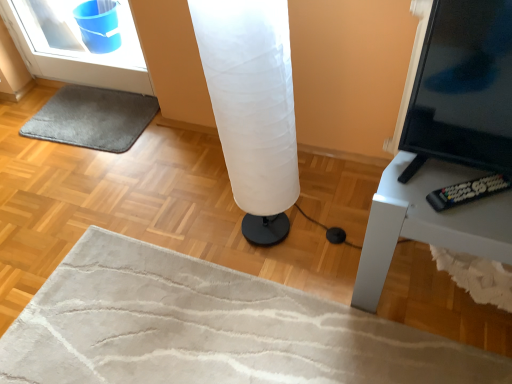
Describe the element at coordinates (463, 88) in the screenshot. I see `black glossy screen at right` at that location.

This screenshot has height=384, width=512. Describe the element at coordinates (252, 106) in the screenshot. I see `white fabric lamp at center` at that location.

Where is `gray soft rug at lower left`? This screenshot has width=512, height=384. gray soft rug at lower left is located at coordinates (92, 118).

At what (x,y) coordinates should I click in order to perform the action: click on black glossy screen at right. Please return your answer as a coordinate pair (x, y). The height and width of the screenshot is (384, 512). Looking at the image, I should click on (463, 88).

Is white fabric lamp at center oriented away from black glossy screen at right?

That's not correct — white fabric lamp at center is not looking away from black glossy screen at right.

Considering the relative positions of white fabric lamp at center and black glossy screen at right in the image provided, is white fabric lamp at center to the left or to the right of black glossy screen at right?

Clearly, white fabric lamp at center is on the left of black glossy screen at right in the image.

From the image's perspective, which one is positioned higher, white fabric lamp at center or black glossy screen at right?

black glossy screen at right, from the image's perspective.

Measure the distance between black plastic tv stand at right and gray soft rug at lower left.

black plastic tv stand at right and gray soft rug at lower left are 4.57 feet apart.

From a real-world perspective, is black plastic tv stand at right under gray soft rug at lower left?

No, from a real-world perspective, black plastic tv stand at right is not below gray soft rug at lower left.

Is black plastic tv stand at right behind gray soft rug at lower left?

No, it is not.

Does point (493, 255) appear closer or farther from the camera than point (104, 138)?

Clearly, point (493, 255) is closer to the camera than point (104, 138).

Looking at their sizes, would you say gray soft rug at lower left is wider or thinner than black glossy screen at right?

gray soft rug at lower left is wider than black glossy screen at right.

In the scene shown: Are gray soft rug at lower left and black glossy screen at right beside each other?

gray soft rug at lower left and black glossy screen at right are not in contact.

Based on the photo, is gray soft rug at lower left inside or outside of black glossy screen at right?

gray soft rug at lower left is not enclosed by black glossy screen at right.

Who is shorter, gray soft rug at lower left or black glossy screen at right?

Standing shorter between the two is gray soft rug at lower left.

From the picture: Which is behind, black glossy screen at right or white fabric lamp at center?

Positioned behind is white fabric lamp at center.

Would you say black glossy screen at right is a long distance from white fabric lamp at center?

No, black glossy screen at right is not far from white fabric lamp at center.

From a real-world perspective, which is physically below, black glossy screen at right or white fabric lamp at center?

From a 3D spatial view, white fabric lamp at center is below.

Which of these two, black glossy screen at right or white fabric lamp at center, stands taller?

white fabric lamp at center is taller.

Measure the distance from white fabric lamp at center to gray soft rug at lower left.

A distance of 38.83 inches exists between white fabric lamp at center and gray soft rug at lower left.

From a real-world perspective, is white fabric lamp at center located beneath gray soft rug at lower left?

Incorrect, from a real-world perspective, white fabric lamp at center is higher than gray soft rug at lower left.

Is gray soft rug at lower left surrounded by white fabric lamp at center?

No, white fabric lamp at center does not contain gray soft rug at lower left.

Looking at this image, from the image's perspective, which is below, white fabric lamp at center or gray soft rug at lower left?

white fabric lamp at center.

Consider the image. Is black glossy screen at right aimed at black plastic tv stand at right?

No, black glossy screen at right does not turn towards black plastic tv stand at right.

Looking at this image, can you confirm if black glossy screen at right is positioned to the right of black plastic tv stand at right?

No.

Does black glossy screen at right lie behind black plastic tv stand at right?

No, black glossy screen at right is in front of black plastic tv stand at right.

From a real-world perspective, is black glossy screen at right over black plastic tv stand at right?

Indeed, from a real-world perspective, black glossy screen at right stands above black plastic tv stand at right.

Is black glossy screen at right in contact with gray soft rug at lower left?

black glossy screen at right and gray soft rug at lower left are not in contact.

Considering the points (501, 136) and (33, 124), which point is in front, point (501, 136) or point (33, 124)?

Point (501, 136)

From the image's perspective, who appears lower, black glossy screen at right or gray soft rug at lower left?

black glossy screen at right, from the image's perspective.

Where is `lamp located on the left of black glossy screen at right`? The image size is (512, 384). lamp located on the left of black glossy screen at right is located at coordinates (252, 106).

Image resolution: width=512 pixels, height=384 pixels. I want to click on yoga mat lying behind the black plastic tv stand at right, so click(x=92, y=118).

Estimate the real-world distances between objects in this image. Which object is further from gray soft rug at lower left, white fabric lamp at center or black glossy screen at right?

black glossy screen at right lies further to gray soft rug at lower left than the other object.

Estimate the real-world distances between objects in this image. Which object is closer to black glossy screen at right, gray soft rug at lower left or black plastic tv stand at right?

black plastic tv stand at right lies closer to black glossy screen at right than the other object.

Considering their positions, is black glossy screen at right positioned further to white fabric lamp at center than black plastic tv stand at right?

black glossy screen at right is positioned further to the anchor white fabric lamp at center.

Based on their spatial positions, is white fabric lamp at center or gray soft rug at lower left further from black plastic tv stand at right?

gray soft rug at lower left is positioned further to the anchor black plastic tv stand at right.

Consider the image. When comparing their distances from gray soft rug at lower left, does black glossy screen at right or black plastic tv stand at right seem closer?

Among the two, black plastic tv stand at right is located nearer to gray soft rug at lower left.

Estimate the real-world distances between objects in this image. Which object is further from white fabric lamp at center, gray soft rug at lower left or black plastic tv stand at right?

Based on the image, gray soft rug at lower left appears to be further to white fabric lamp at center.

Looking at the image, which one is located closer to black plastic tv stand at right, black glossy screen at right or white fabric lamp at center?

black glossy screen at right is closer to black plastic tv stand at right.

Considering their positions, is white fabric lamp at center positioned closer to gray soft rug at lower left than black plastic tv stand at right?

white fabric lamp at center is positioned closer to the anchor gray soft rug at lower left.

Find the location of a particular element. screen between gray soft rug at lower left and black plastic tv stand at right in the horizontal direction is located at coordinates (463, 88).

Identify the location of lamp between gray soft rug at lower left and black plastic tv stand at right. Image resolution: width=512 pixels, height=384 pixels. (252, 106).

Find the location of a particular element. The width and height of the screenshot is (512, 384). lamp located between black glossy screen at right and gray soft rug at lower left in the depth direction is located at coordinates (252, 106).

What are the coordinates of `screen between white fabric lamp at center and black plastic tv stand at right in the horizontal direction` in the screenshot? It's located at (463, 88).